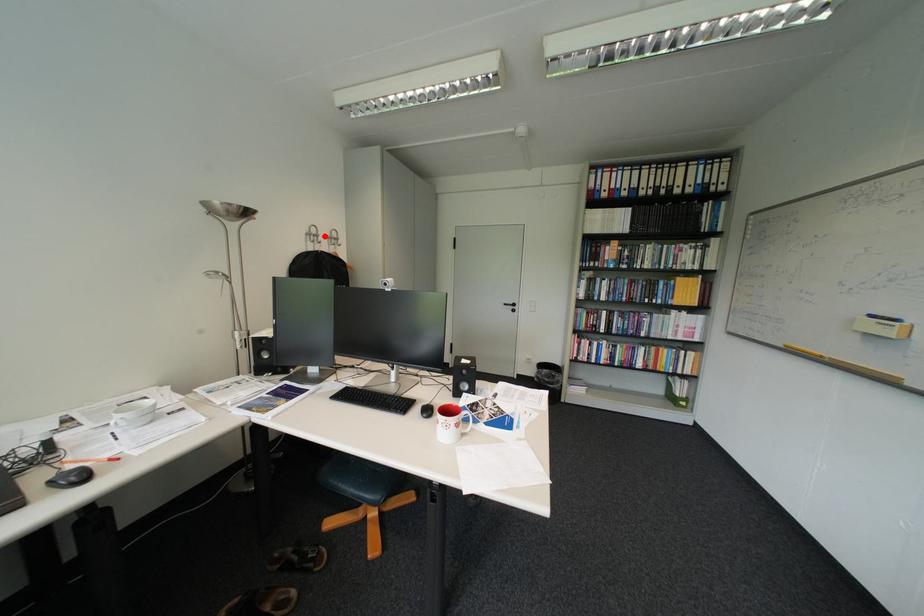
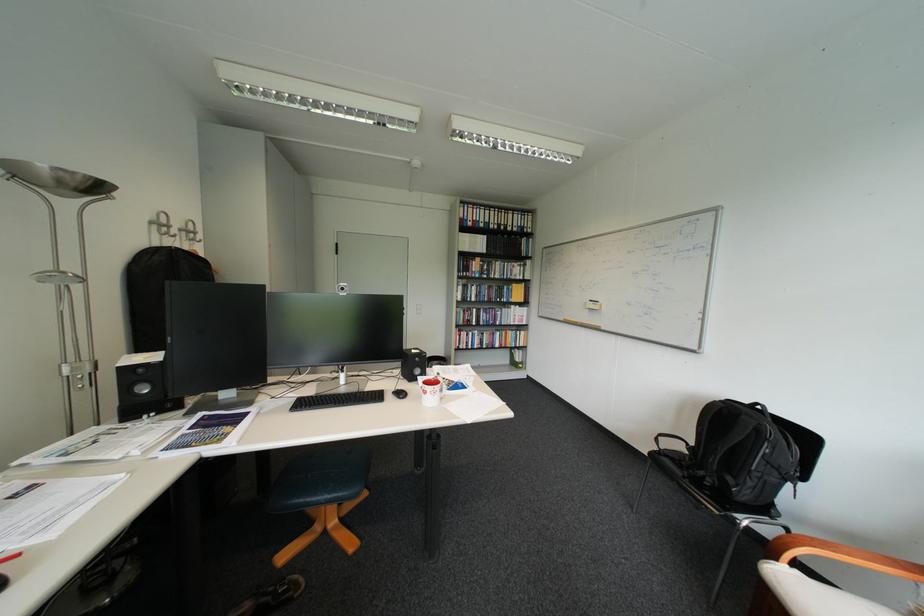
In the second image, find the point that corresponds to the highlighted location in the first image.

(173, 225)